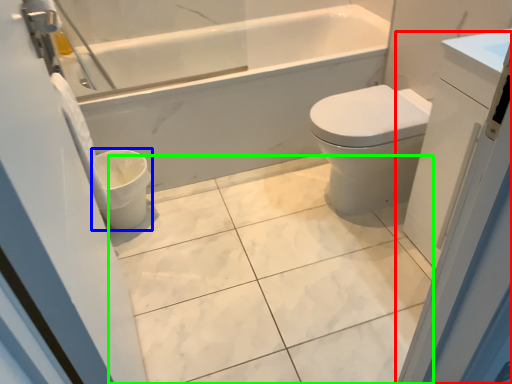
Question: Based on their relative distances, which object is nearer to screen door (highlighted by a red box)? Choose from toilet bowl (highlighted by a blue box) and ceramic tile (highlighted by a green box).

Choices:
 (A) toilet bowl
 (B) ceramic tile

Answer: (B)